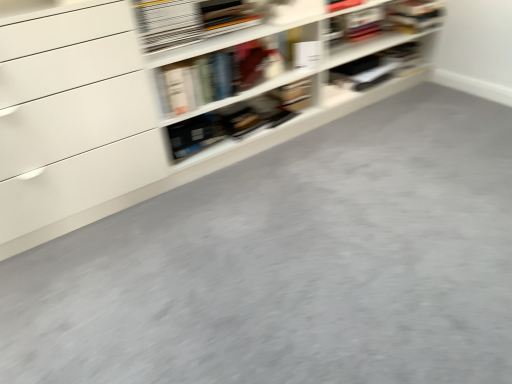
Question: In the image, is hardcover book at upper center, the 2th book viewed from the right, on the left side or the right side of white matte shelf at upper center?

Choices:
 (A) right
 (B) left

Answer: (B)

Question: Looking at the image, does hardcover book at upper center, the second book positioned from the back, seem bigger or smaller compared to white matte shelf at upper center?

Choices:
 (A) big
 (B) small

Answer: (B)

Question: Which object is positioned closest to the white matte shelf at upper center?

Choices:
 (A) matte black book at upper center, which is the 1th book from right to left
 (B) hardcover book at upper center, which is the first book from front to back

Answer: (B)

Question: Considering the real-world distances, which object is farthest from the white matte shelf at upper center?

Choices:
 (A) matte black book at upper center, marked as the 1th book in a back-to-front arrangement
 (B) hardcover book at upper center, which is the first book from front to back

Answer: (A)